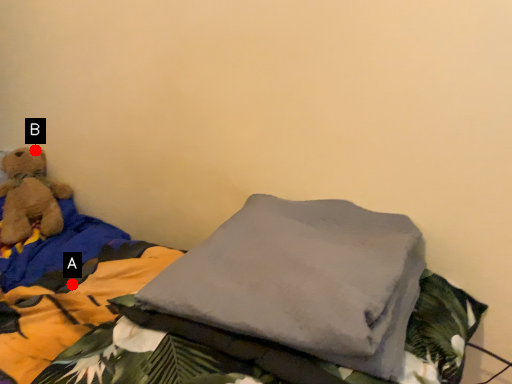
Question: Two points are circled on the image, labeled by A and B beside each circle. Which of the following is the closest to the observer?

Choices:
 (A) A is closer
 (B) B is closer

Answer: (A)